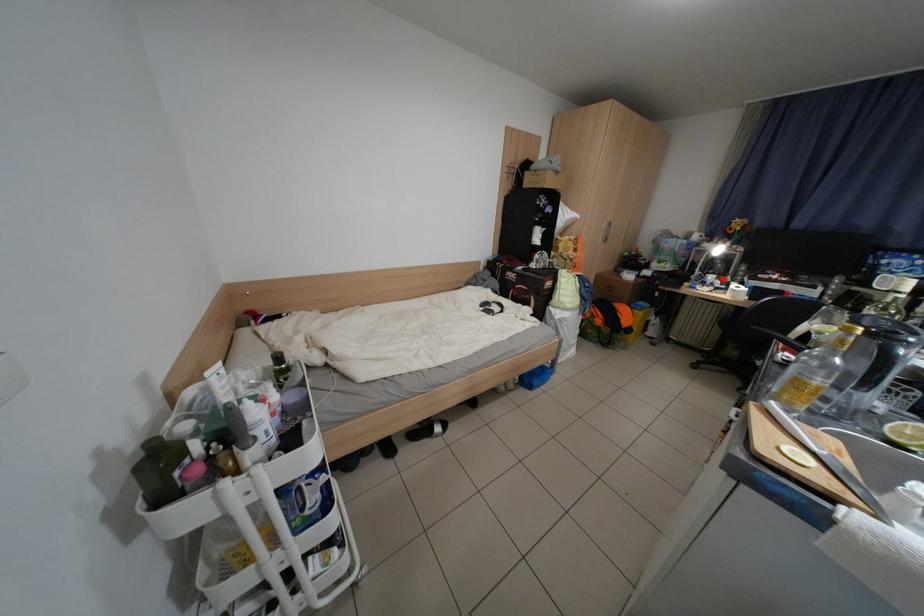
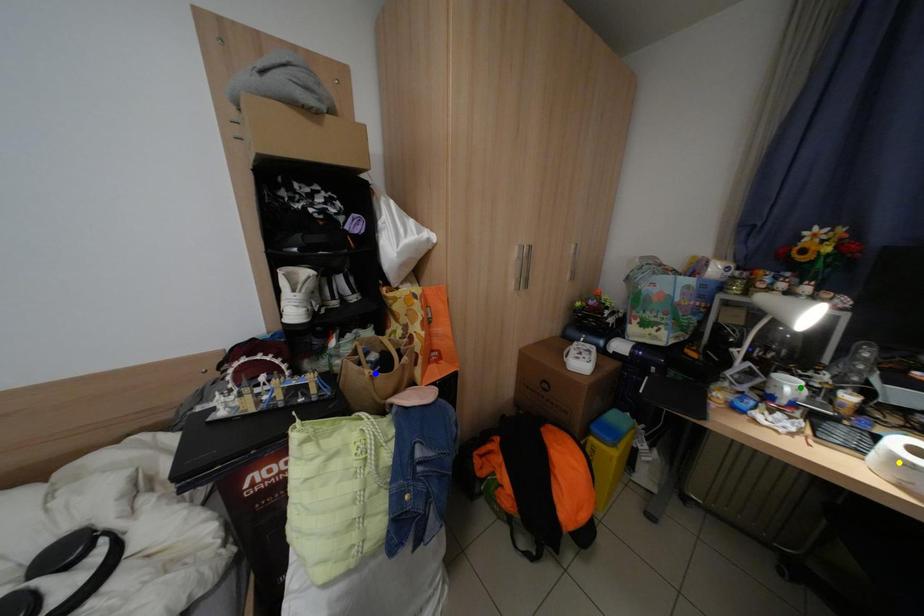
Question: I am providing you with two images of the same scene from different viewpoints. A red point is marked on the first image. You are given multiple points on the second image. Which spot in image 2 lines up with the point in image 1?

Choices:
 (A) yellow point
 (B) green point
 (C) blue point

Answer: (B)